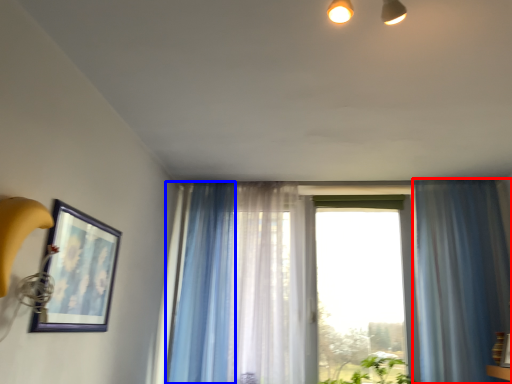
Question: Among these objects, which one is nearest to the camera, curtain (highlighted by a red box) or curtain (highlighted by a blue box)?

Choices:
 (A) curtain
 (B) curtain

Answer: (A)